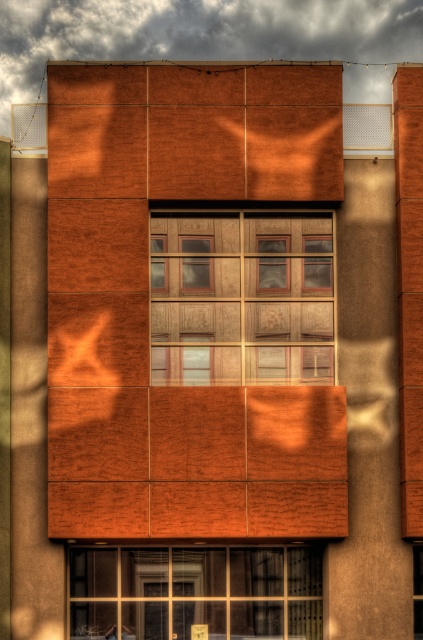
Question: Does wooden windows at center come behind clear glass window at lower center?

Choices:
 (A) no
 (B) yes

Answer: (A)

Question: Which of the following is the closest to the observer?

Choices:
 (A) (302, 600)
 (B) (217, 253)

Answer: (A)

Question: Which point appears farthest from the camera in this image?

Choices:
 (A) (214, 292)
 (B) (321, 616)

Answer: (A)

Question: Does wooden windows at center have a greater width compared to clear glass window at lower center?

Choices:
 (A) no
 (B) yes

Answer: (A)

Question: Is wooden windows at center to the right of clear glass window at lower center from the viewer's perspective?

Choices:
 (A) yes
 (B) no

Answer: (A)